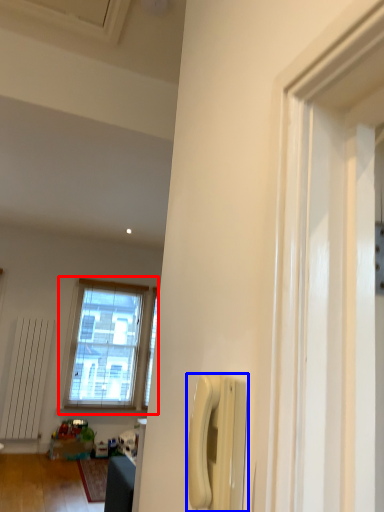
Question: Which object is closer to the camera taking this photo, window (highlighted by a red box) or corded phone (highlighted by a blue box)?

Choices:
 (A) window
 (B) corded phone

Answer: (B)